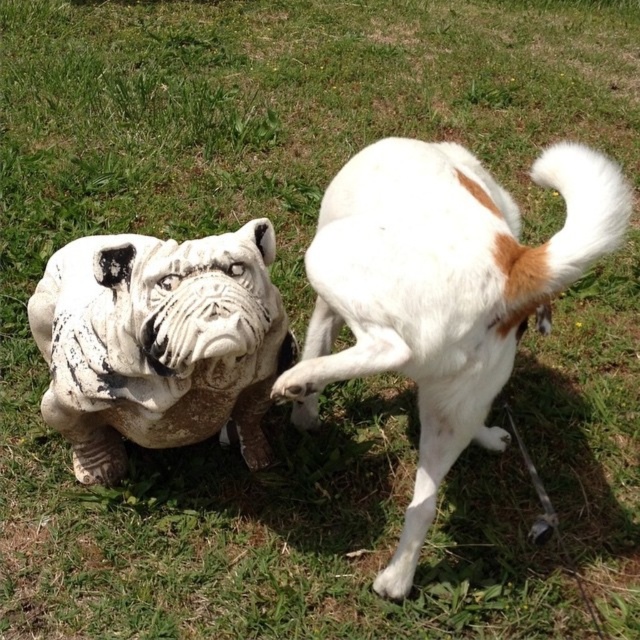
Does white fur dog at right have a lesser height compared to white stone statue at center?

No, white fur dog at right is not shorter than white stone statue at center.

Is white fur dog at right closer to the viewer compared to white stone statue at center?

Yes.

Which is in front, point (472, 196) or point (115, 285)?

Point (472, 196) is more forward.

The width and height of the screenshot is (640, 640). Identify the location of white fur dog at right. (442, 291).